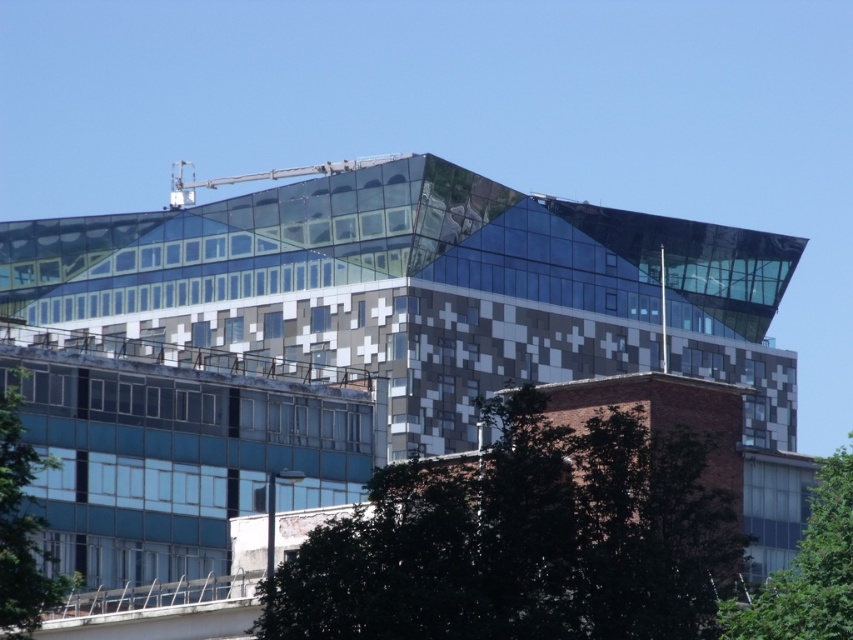
You are standing in front of the modern architectural structure and notice two green leafy trees. Which tree, the green leafy tree at center or the green leafy tree at lower right, is closer to the building?

The green leafy tree at lower right is closer to the building because the green leafy tree at center is positioned over it, indicating it is further away from the observer.

You are an urban planner assessing the visibility of the modern building. You notice two green leafy trees in the foreground. Which tree, the green leafy tree at center or the green leafy tree at lower right, is smaller and might block less of the building?

The green leafy tree at center is smaller compared to the green leafy tree at lower right, so it might block less of the building.